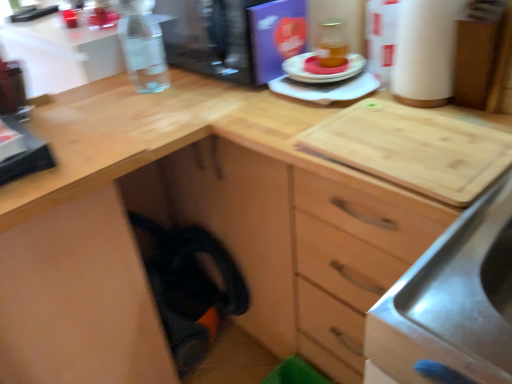
Question: From a real-world perspective, is matte plastic plate at center, placed as the first appliance when sorted from bottom to top, beneath transparent plastic water bottle at upper left, the first appliance viewed from the top?

Choices:
 (A) yes
 (B) no

Answer: (A)

Question: Does matte plastic plate at center, placed as the second appliance when sorted from top to bottom, touch transparent plastic water bottle at upper left, the first appliance viewed from the top?

Choices:
 (A) yes
 (B) no

Answer: (B)

Question: From the image's perspective, is matte plastic plate at center, placed as the first appliance when sorted from bottom to top, under transparent plastic water bottle at upper left, placed as the 2th appliance when sorted from bottom to top?

Choices:
 (A) yes
 (B) no

Answer: (A)

Question: Can you confirm if matte plastic plate at center, placed as the first appliance when sorted from bottom to top, is thinner than transparent plastic water bottle at upper left, placed as the 2th appliance when sorted from bottom to top?

Choices:
 (A) no
 (B) yes

Answer: (B)

Question: Considering the relative sizes of matte plastic plate at center, placed as the second appliance when sorted from top to bottom, and transparent plastic water bottle at upper left, the first appliance viewed from the top, in the image provided, is matte plastic plate at center, placed as the second appliance when sorted from top to bottom, wider than transparent plastic water bottle at upper left, the first appliance viewed from the top,?

Choices:
 (A) yes
 (B) no

Answer: (B)

Question: Choose the correct answer: Is transparent plastic water bottle at upper left, the first appliance viewed from the top, inside matte orange cake at center or outside it?

Choices:
 (A) outside
 (B) inside

Answer: (A)

Question: In the image, is transparent plastic water bottle at upper left, the first appliance viewed from the top, positioned in front of or behind matte orange cake at center?

Choices:
 (A) front
 (B) behind

Answer: (A)

Question: In terms of width, does transparent plastic water bottle at upper left, the first appliance viewed from the top, look wider or thinner when compared to matte orange cake at center?

Choices:
 (A) thin
 (B) wide

Answer: (B)

Question: Does point (275, 49) appear closer or farther from the camera than point (316, 56)?

Choices:
 (A) farther
 (B) closer

Answer: (A)

Question: From the image's perspective, is matte orange cake at center above or below white cardboard paper towel at upper right?

Choices:
 (A) above
 (B) below

Answer: (B)

Question: Is point (344, 69) positioned closer to the camera than point (409, 41)?

Choices:
 (A) closer
 (B) farther

Answer: (B)

Question: Is matte orange cake at center to the left or to the right of white cardboard paper towel at upper right in the image?

Choices:
 (A) left
 (B) right

Answer: (A)

Question: Would you say matte orange cake at center is inside or outside white cardboard paper towel at upper right?

Choices:
 (A) inside
 (B) outside

Answer: (B)

Question: Would you say transparent plastic water bottle at upper left, the first appliance viewed from the top, is to the left or to the right of clear glass bottle at upper left in the picture?

Choices:
 (A) left
 (B) right

Answer: (B)

Question: In terms of width, does transparent plastic water bottle at upper left, the first appliance viewed from the top, look wider or thinner when compared to clear glass bottle at upper left?

Choices:
 (A) thin
 (B) wide

Answer: (B)